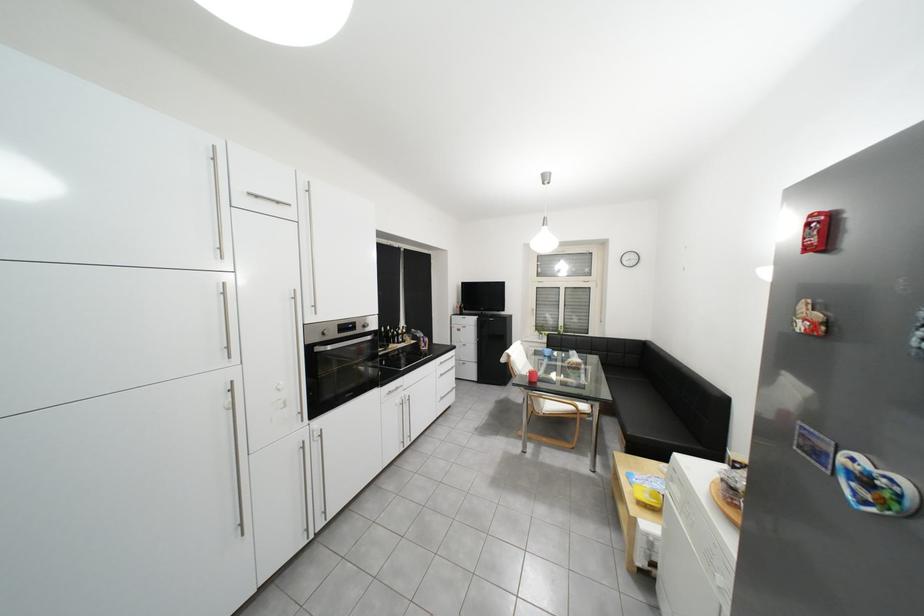
The width and height of the screenshot is (924, 616). What do you see at coordinates (565, 407) in the screenshot?
I see `the chair sitting surface` at bounding box center [565, 407].